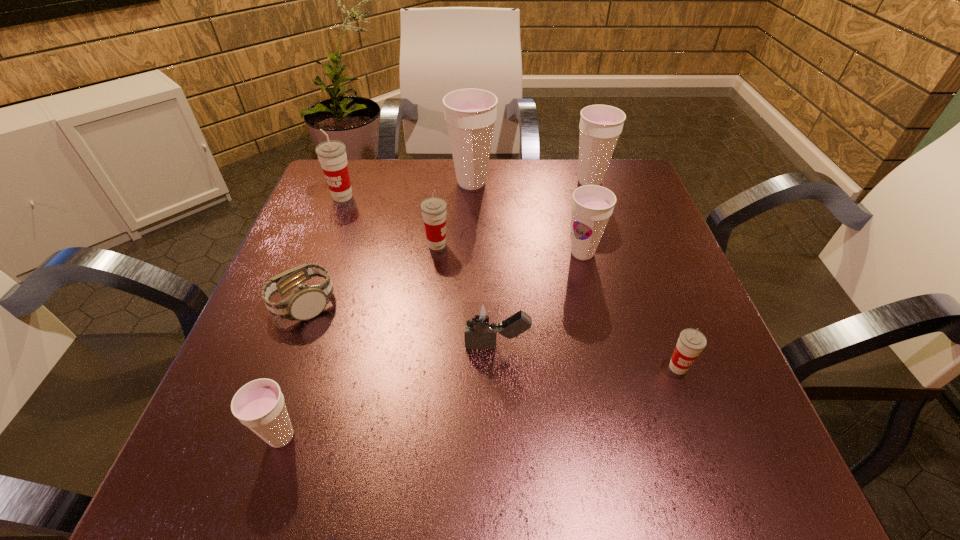
Where is `purple cup that is the closest to the second purple cup from left to right`? The width and height of the screenshot is (960, 540). purple cup that is the closest to the second purple cup from left to right is located at coordinates (600, 126).

Identify the location of red cup that stands as the second closest to the second biggest purple cup. (691, 342).

Identify which red cup is the closest to the second nearest red cup. Please provide its 2D coordinates. Your answer should be formatted as a tuple, i.e. [(x, y)], where the tuple contains the x and y coordinates of a point satisfying the conditions above.

[(332, 156)]

Locate an element on the screen. This screenshot has height=540, width=960. blank area in the image that satisfies the following two spatial constraints: 1. on the side of the farthest red cup with the logo; 2. on the left side of the leftmost purple cup is located at coordinates (252, 437).

At what (x,y) coordinates should I click in order to perform the action: click on vacant space that satisfies the following two spatial constraints: 1. on the side of the gray igniter with the logo; 2. on the left side of the second smallest red cup. Please return your answer as a coordinate pair (x, y). The height and width of the screenshot is (540, 960). Looking at the image, I should click on (426, 346).

This screenshot has width=960, height=540. Identify the location of free space that satisfies the following two spatial constraints: 1. on the side of the second red cup from left to right with the logo; 2. on the right side of the third biggest purple cup. (436, 253).

Locate an element on the screen. blank area in the image that satisfies the following two spatial constraints: 1. on the front side of the tallest cup; 2. on the face of the watch is located at coordinates (468, 303).

You are a GUI agent. You are given a task and a screenshot of the screen. Output one action in this format:
    pyautogui.click(x=<x>, y=<y>)
    Task: Click on the vacant space that satisfies the following two spatial constraints: 1. on the back side of the nearest cup; 2. on the right side of the igniter
    
    Given the screenshot: What is the action you would take?
    pyautogui.click(x=311, y=346)

The width and height of the screenshot is (960, 540). Identify the location of free space that satisfies the following two spatial constraints: 1. on the face of the shortest object; 2. on the right side of the gray igniter. (287, 346).